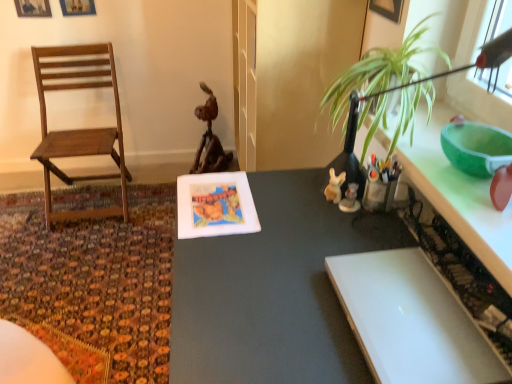
The height and width of the screenshot is (384, 512). Find the location of `free point in front of white matte rabbit at center-right, which ranks as the 2th toy in right-to-left order`. free point in front of white matte rabbit at center-right, which ranks as the 2th toy in right-to-left order is located at coordinates (336, 233).